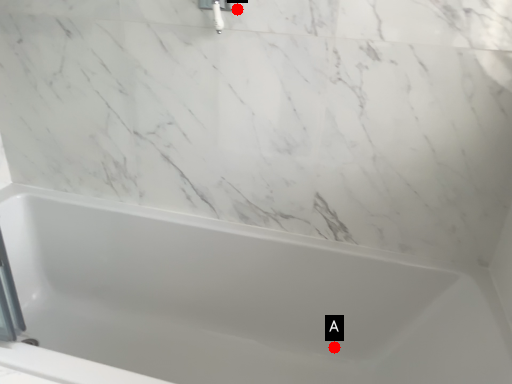
Question: Two points are circled on the image, labeled by A and B beside each circle. Which of the following is the farthest from the observer?

Choices:
 (A) A is further
 (B) B is further

Answer: (A)